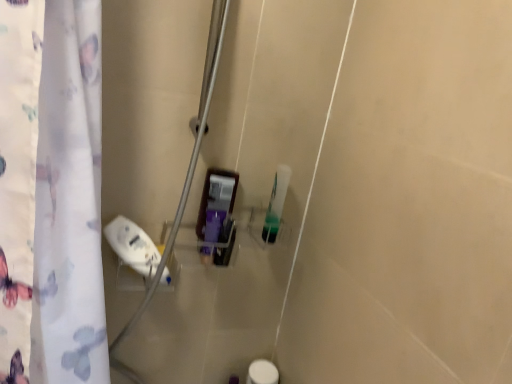
Describe the element at coordinates (217, 206) in the screenshot. I see `translucent plastic container at center, the first toiletry viewed from the front` at that location.

Locate an element on the screen. This screenshot has height=384, width=512. translucent plastic container at center, the first toiletry viewed from the front is located at coordinates (217, 206).

The height and width of the screenshot is (384, 512). Describe the element at coordinates (276, 204) in the screenshot. I see `green translucent bottle at center, the 1th toiletry from the back` at that location.

I want to click on green translucent bottle at center, the 1th toiletry from the back, so click(x=276, y=204).

Locate an element on the screen. Image resolution: width=512 pixels, height=384 pixels. translucent plastic container at center, arranged as the 2th toiletry when viewed from the back is located at coordinates (217, 206).

Considering the relative positions of translucent plastic container at center, the 2th toiletry when ordered from right to left, and green translucent bottle at center, the 1th toiletry from the back, in the image provided, is translucent plastic container at center, the 2th toiletry when ordered from right to left, to the left or to the right of green translucent bottle at center, the 1th toiletry from the back,?

translucent plastic container at center, the 2th toiletry when ordered from right to left, is positioned on green translucent bottle at center, the 1th toiletry from the back,'s left side.

Based on the photo, considering their positions, is translucent plastic container at center, arranged as the 2th toiletry when viewed from the back, located in front of or behind green translucent bottle at center, the 2th toiletry from the left?

In the image, translucent plastic container at center, arranged as the 2th toiletry when viewed from the back, appears in front of green translucent bottle at center, the 2th toiletry from the left.

Does point (215, 259) come farther from viewer compared to point (282, 208)?

No, (215, 259) is in front of (282, 208).

From the image's perspective, which one is positioned higher, translucent plastic container at center, which is counted as the 1th toiletry, starting from the left, or green translucent bottle at center, the 2th toiletry from the left?

green translucent bottle at center, the 2th toiletry from the left, appears higher in the image.

From a real-world perspective, relative to green translucent bottle at center, the 2th toiletry from the left, is translucent plastic container at center, arranged as the 2th toiletry when viewed from the back, vertically above or below?

translucent plastic container at center, arranged as the 2th toiletry when viewed from the back, is situated lower than green translucent bottle at center, the 2th toiletry from the left, in the real world.

Is translucent plastic container at center, which is counted as the 1th toiletry, starting from the left, thinner than green translucent bottle at center, the 2th toiletry from the left?

Incorrect, the width of translucent plastic container at center, which is counted as the 1th toiletry, starting from the left, is not less than that of green translucent bottle at center, the 2th toiletry from the left.

Who is taller, translucent plastic container at center, the first toiletry viewed from the front, or green translucent bottle at center, the 2th toiletry from the left?

Standing taller between the two is green translucent bottle at center, the 2th toiletry from the left.

Considering the relative sizes of translucent plastic container at center, the first toiletry viewed from the front, and green translucent bottle at center, the 2th toiletry from the left, in the image provided, is translucent plastic container at center, the first toiletry viewed from the front, smaller than green translucent bottle at center, the 2th toiletry from the left,?

Incorrect, translucent plastic container at center, the first toiletry viewed from the front, is not smaller in size than green translucent bottle at center, the 2th toiletry from the left.

Is translucent plastic container at center, the 2th toiletry when ordered from right to left, positioned beyond the bounds of green translucent bottle at center, the 2th toiletry from the left?

Yes, translucent plastic container at center, the 2th toiletry when ordered from right to left, is not within green translucent bottle at center, the 2th toiletry from the left.

Are translucent plastic container at center, arranged as the 2th toiletry when viewed from the back, and green translucent bottle at center, the 1th toiletry from the back, beside each other?

No, translucent plastic container at center, arranged as the 2th toiletry when viewed from the back, is not with green translucent bottle at center, the 1th toiletry from the back.

Is translucent plastic container at center, the first toiletry viewed from the front, looking in the opposite direction of green translucent bottle at center, the 2th toiletry from the left?

No.

How many degrees apart are the facing directions of translucent plastic container at center, arranged as the 2th toiletry when viewed from the back, and green translucent bottle at center, the 2th toiletry from the left?

They differ by 4.18 degrees in their facing directions.

Find the location of a particular element. The height and width of the screenshot is (384, 512). toiletry above the translucent plastic container at center, the first toiletry viewed from the front (from the image's perspective) is located at coordinates click(x=276, y=204).

Which is more to the right, green translucent bottle at center, the 2th toiletry positioned from the front, or translucent plastic container at center, arranged as the 2th toiletry when viewed from the back?

green translucent bottle at center, the 2th toiletry positioned from the front.

Considering their positions, is green translucent bottle at center, the 1th toiletry from the back, located in front of or behind translucent plastic container at center, the first toiletry viewed from the front?

Visually, green translucent bottle at center, the 1th toiletry from the back, is located behind translucent plastic container at center, the first toiletry viewed from the front.

Is point (273, 235) farther from viewer compared to point (215, 262)?

That is False.

From the image's perspective, is green translucent bottle at center, the 1th toiletry from the back, under translucent plastic container at center, the 2th toiletry when ordered from right to left?

Actually, green translucent bottle at center, the 1th toiletry from the back, appears above translucent plastic container at center, the 2th toiletry when ordered from right to left, in the image.

From a real-world perspective, between green translucent bottle at center, the 2th toiletry from the left, and translucent plastic container at center, which is counted as the 1th toiletry, starting from the left, who is vertically higher?

green translucent bottle at center, the 2th toiletry from the left.

Does green translucent bottle at center, which is counted as the 1th toiletry, starting from the right, have a lesser width compared to translucent plastic container at center, which is counted as the 1th toiletry, starting from the left?

Yes, green translucent bottle at center, which is counted as the 1th toiletry, starting from the right, is thinner than translucent plastic container at center, which is counted as the 1th toiletry, starting from the left.

Between green translucent bottle at center, the 1th toiletry from the back, and translucent plastic container at center, the 2th toiletry when ordered from right to left, which one has more height?

With more height is green translucent bottle at center, the 1th toiletry from the back.

Can you confirm if green translucent bottle at center, the 2th toiletry positioned from the front, is smaller than translucent plastic container at center, arranged as the 2th toiletry when viewed from the back?

Indeed, green translucent bottle at center, the 2th toiletry positioned from the front, has a smaller size compared to translucent plastic container at center, arranged as the 2th toiletry when viewed from the back.

Is translucent plastic container at center, arranged as the 2th toiletry when viewed from the back, inside green translucent bottle at center, the 2th toiletry positioned from the front?

No, translucent plastic container at center, arranged as the 2th toiletry when viewed from the back, is located outside of green translucent bottle at center, the 2th toiletry positioned from the front.

Is green translucent bottle at center, the 2th toiletry positioned from the front, touching translucent plastic container at center, the 2th toiletry when ordered from right to left?

No.

Is green translucent bottle at center, the 1th toiletry from the back, positioned with its back to translucent plastic container at center, arranged as the 2th toiletry when viewed from the back?

No, green translucent bottle at center, the 1th toiletry from the back,'s orientation is not away from translucent plastic container at center, arranged as the 2th toiletry when viewed from the back.

From the picture: How different are the orientations of green translucent bottle at center, which is counted as the 1th toiletry, starting from the right, and translucent plastic container at center, the first toiletry viewed from the front, in degrees?

4.18 degrees separate the facing orientations of green translucent bottle at center, which is counted as the 1th toiletry, starting from the right, and translucent plastic container at center, the first toiletry viewed from the front.

Measure the distance between green translucent bottle at center, the 2th toiletry from the left, and translucent plastic container at center, the first toiletry viewed from the front.

The distance of green translucent bottle at center, the 2th toiletry from the left, from translucent plastic container at center, the first toiletry viewed from the front, is 5.16 inches.

Find the location of a particular element. Image resolution: width=512 pixels, height=384 pixels. toiletry in front of the green translucent bottle at center, the 2th toiletry positioned from the front is located at coordinates (217, 206).

The height and width of the screenshot is (384, 512). I want to click on toiletry on the left of green translucent bottle at center, which is counted as the 1th toiletry, starting from the right, so click(217, 206).

Locate an element on the screen. toiletry on the right of the translucent plastic container at center, arranged as the 2th toiletry when viewed from the back is located at coordinates (276, 204).